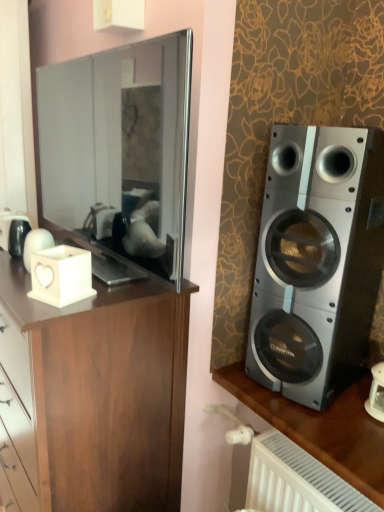
Question: From the image's perspective, is matte black mirror at left positioned above or below silver metallic speaker at right?

Choices:
 (A) below
 (B) above

Answer: (B)

Question: Do you think matte black mirror at left is within silver metallic speaker at right, or outside of it?

Choices:
 (A) inside
 (B) outside

Answer: (B)

Question: Which object is the farthest from the metallic silver speaker at right?

Choices:
 (A) white matte candle holder at left
 (B) brown wood cabinet at left
 (C) matte black mirror at left
 (D) silver metallic speaker at right

Answer: (C)

Question: Estimate the real-world distances between objects in this image. Which object is farther from the silver metallic speaker at right?

Choices:
 (A) brown wood cabinet at left
 (B) matte black mirror at left
 (C) metallic silver speaker at right
 (D) white matte candle holder at left

Answer: (D)